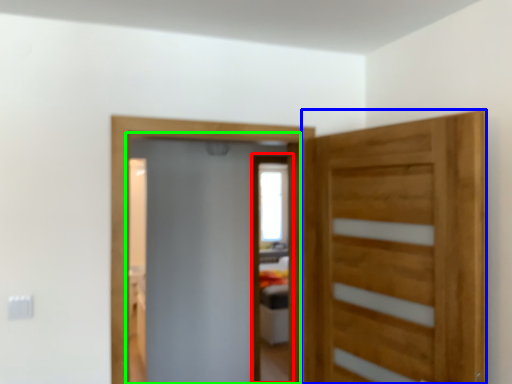
Question: Estimate the real-world distances between objects in this image. Which object is closer to screen door (highlighted by a red box), door (highlighted by a blue box) or screen door (highlighted by a green box)?

Choices:
 (A) door
 (B) screen door

Answer: (B)